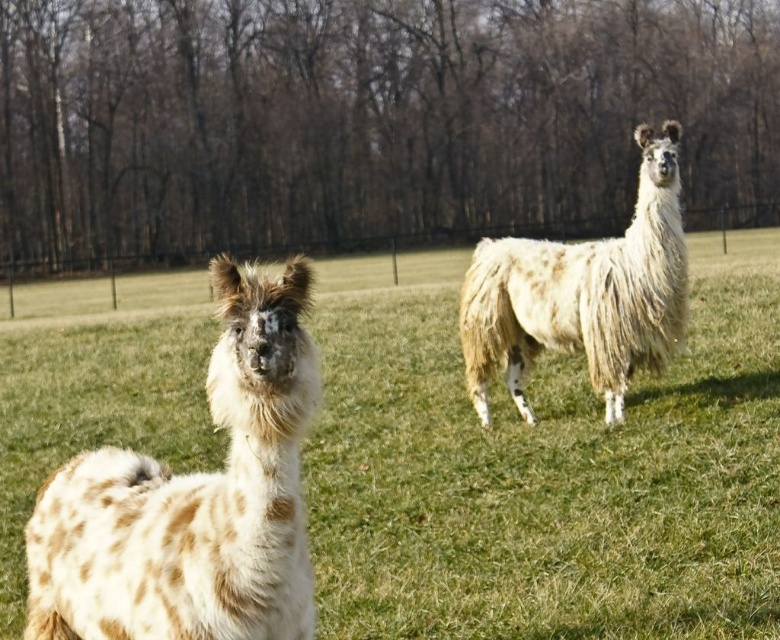
You are a farmer who needs to fit both animals into a trailer that can only accommodate animals with a combined width of 1.5 meters. If the spotted wool llama at center is wider than the fuzzy white alpaca at right, what should you do to ensure both animals can fit?

The spotted wool llama at center is wider than the fuzzy white alpaca at right. To ensure both animals can fit into the trailer, you should measure their individual widths and confirm their combined total does not exceed 1.5 meters. If together they are under the limit, they can be transported safely.

Based on the photo, you are a photographer standing at the position of the camera. You want to take a closeup photo of the speckled wool alpaca at left. Can you reach it with your 1.5 meter long selfie stick?

The speckled wool alpaca at left and camera are 1.70 meters apart. Since the selfie stick is 1.5 meters long, it is not long enough to reach the speckled wool alpaca at left.

You are a farmer who needs to fit both the spotted wool llama at center and the speckled wool alpaca at left into a 2.5 meter wide trailer. Given their widths, can both animals fit side by side?

The spotted wool llama at center is wider than the speckled wool alpaca at left, but their combined widths must be less than or equal to 2.5 meters. However, since the exact widths are not provided, it is impossible to determine if they can fit side by side in the trailer.